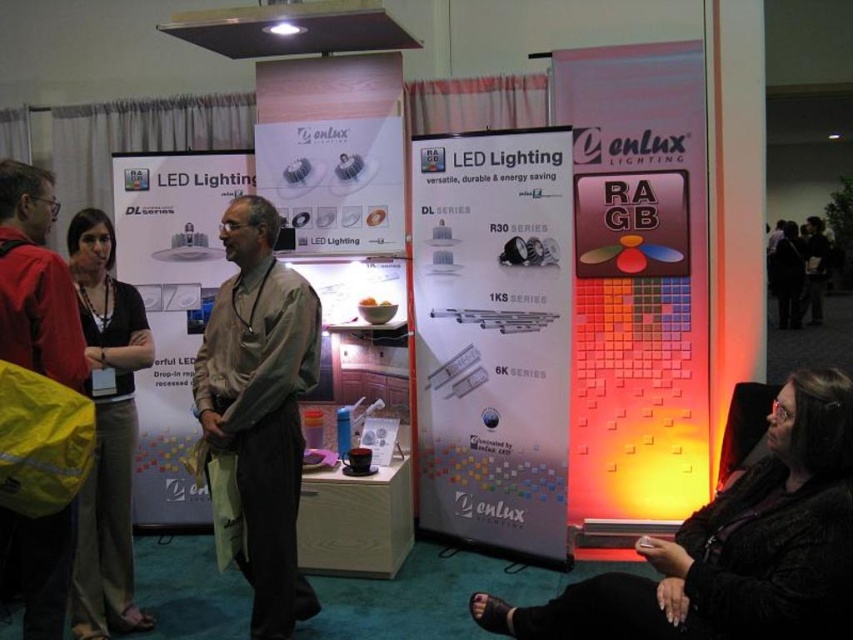
Question: Can you confirm if white paper poster at center is bigger than light brown fabric shirt at center?

Choices:
 (A) no
 (B) yes

Answer: (B)

Question: Among these objects, which one is farthest from the camera?

Choices:
 (A) white glossy poster at center
 (B) red jacket at left
 (C) matte plastic poster at right

Answer: (A)

Question: Can you confirm if matte plastic poster at right is thinner than matte white led lighting at center?

Choices:
 (A) no
 (B) yes

Answer: (A)

Question: Which of the following is the closest to the observer?

Choices:
 (A) 143,230
 (B) 744,548
 (C) 488,426
 (D) 293,172

Answer: (B)

Question: Can you confirm if light brown fabric shirt at center is bigger than matte white led lighting at center?

Choices:
 (A) yes
 (B) no

Answer: (A)

Question: Among these objects, which one is nearest to the camera?

Choices:
 (A) light brown fabric shirt at center
 (B) red jacket at left
 (C) matte plastic poster at right

Answer: (B)